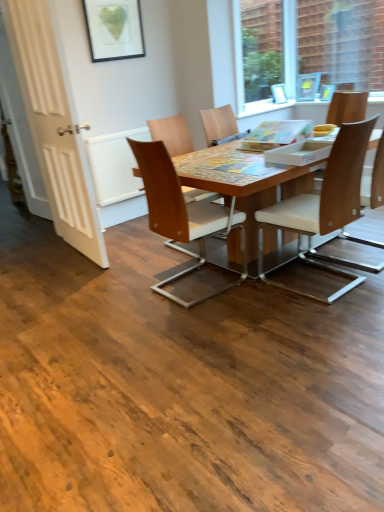
The image size is (384, 512). Identify the location of free space to the left of wooden chair at center, which is counted as the 1th chair, starting from the left. (124, 304).